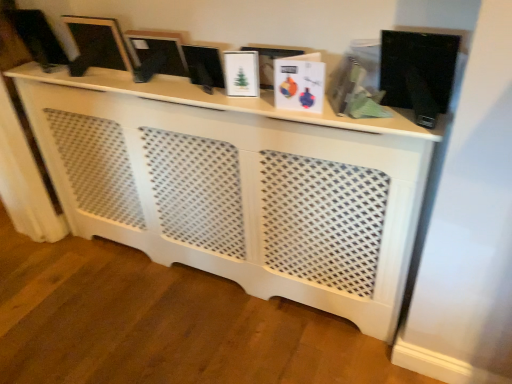
The height and width of the screenshot is (384, 512). Find the location of `free space in front of black glossy computer monitor at center, arranged as the 1th computer monitor when viewed from the right`. free space in front of black glossy computer monitor at center, arranged as the 1th computer monitor when viewed from the right is located at coordinates (221, 100).